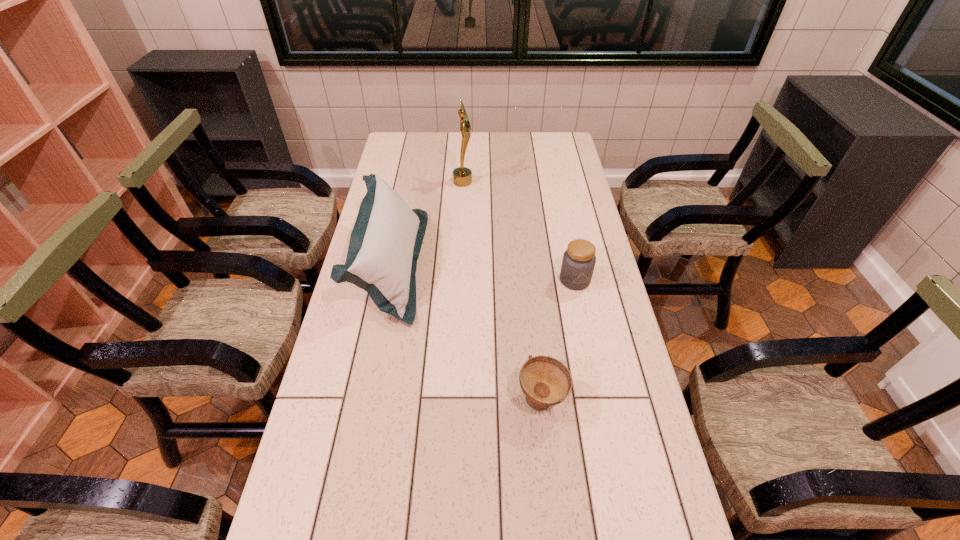
Find the location of `free spot located 0.130m on the surface of the rightmost object near the warning symbol`. free spot located 0.130m on the surface of the rightmost object near the warning symbol is located at coordinates pyautogui.click(x=584, y=325).

This screenshot has width=960, height=540. In order to click on free space located 0.340m on the left of the second object from right to left in this screenshot , I will do `click(381, 400)`.

Find the location of a particular element. The height and width of the screenshot is (540, 960). object at the left edge is located at coordinates (385, 243).

Locate an element on the screen. The height and width of the screenshot is (540, 960). object at the right edge is located at coordinates (578, 263).

This screenshot has height=540, width=960. Identify the location of blank area at the far edge. (507, 147).

In the image, there is a desktop. Identify the location of vacant space at the left edge. (339, 357).

I want to click on vacant space at the right edge, so click(547, 207).

The height and width of the screenshot is (540, 960). In order to click on free space at the far left corner of the desktop in this screenshot , I will do `click(414, 138)`.

Where is `vacant area at the far right corner of the desktop`? This screenshot has height=540, width=960. vacant area at the far right corner of the desktop is located at coordinates (567, 134).

This screenshot has width=960, height=540. Find the location of `vacant space in between the jar and the third object from right to left`. vacant space in between the jar and the third object from right to left is located at coordinates (x=518, y=231).